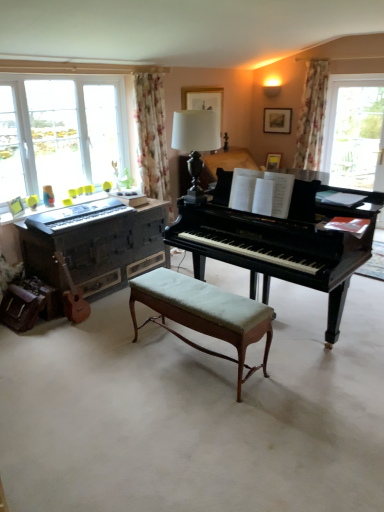
Question: Would you say white glossy table lamp at center is to the left or to the right of matte black keyboard at left in the picture?

Choices:
 (A) left
 (B) right

Answer: (B)

Question: Considering the positions of point (200, 159) and point (99, 209), is point (200, 159) closer or farther from the camera than point (99, 209)?

Choices:
 (A) closer
 (B) farther

Answer: (A)

Question: Estimate the real-world distances between objects in this image. Which object is farther from the black polished wood piano at center, acting as the first piano starting from the right?

Choices:
 (A) floral fabric curtain at upper right
 (B) white glossy table lamp at center
 (C) matte black keyboard at left
 (D) wooden acoustic guitar at lower left
 (E) light green upholstered bench at center

Answer: (A)

Question: Estimate the real-world distances between objects in this image. Which object is farther from the matte black keyboard at left?

Choices:
 (A) floral fabric curtain at upper right
 (B) black polished wood piano at center, which appears as the 2th piano when viewed from the left
 (C) wooden acoustic guitar at lower left
 (D) wooden piano at left, the 1th piano viewed from the left
 (E) white glossy table lamp at center

Answer: (A)